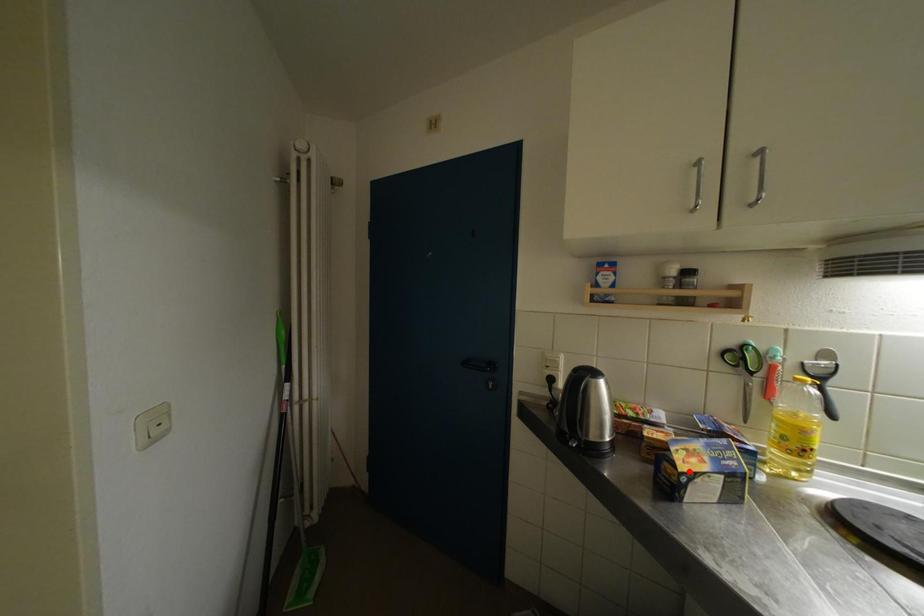
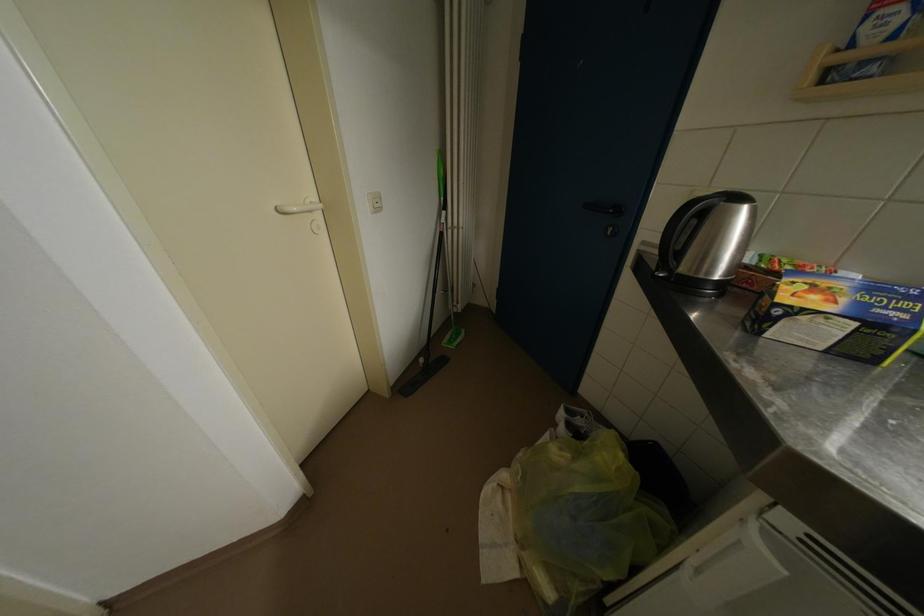
Find the pixel in the second image that matches the highlighted location in the first image.

(791, 302)